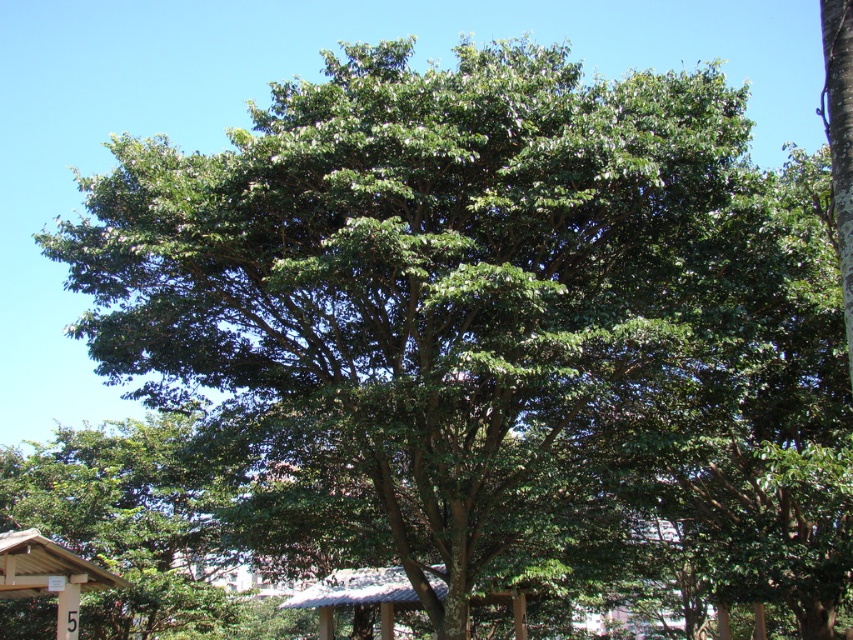
You are planning to place a new bench in the scene. The bench requires a space wider than the wooden sign at lower left. Can the thatched roof gazebo at center provide enough space for the bench?

The thatched roof gazebo at center is wider than the wooden sign at lower left, so it can provide enough space for the bench.

You are planning to install a new birdhouse in the scene. The birdhouse requires a mounting height of at least 2 meters. Given the thatched roof gazebo at center and wooden sign at lower left, which object would be suitable for mounting the birdhouse based on their heights?

The thatched roof gazebo at center is taller than the wooden sign at lower left, so the thatched roof gazebo at center would be suitable for mounting the birdhouse as it meets the required height of at least 2 meters.